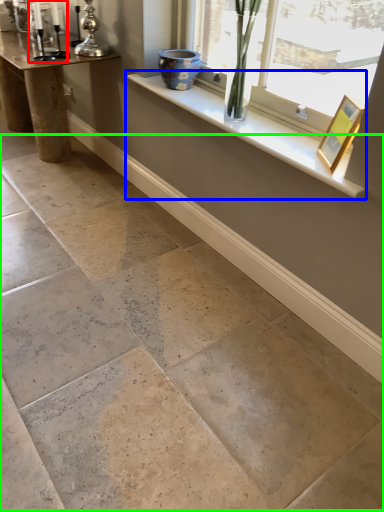
Question: Considering the real-world distances, which object is farthest from candle holder (highlighted by a red box)? window sill (highlighted by a blue box) or concrete (highlighted by a green box)?

Choices:
 (A) window sill
 (B) concrete

Answer: (B)